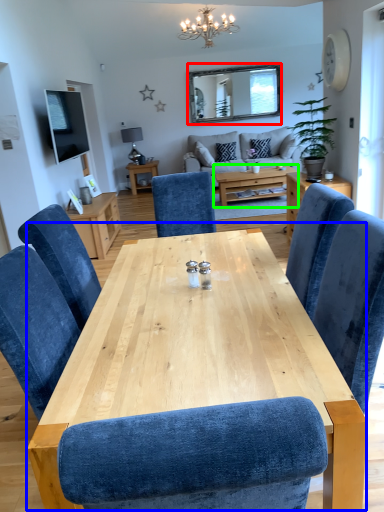
Question: Estimate the real-world distances between objects in this image. Which object is farther from mirror (highlighted by a red box), table (highlighted by a blue box) or coffee table (highlighted by a green box)?

Choices:
 (A) table
 (B) coffee table

Answer: (A)